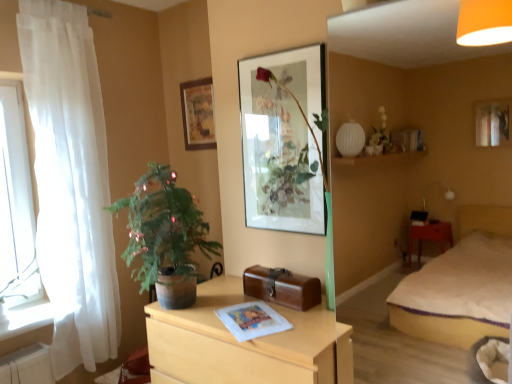
Question: Is the depth of green matte potted plant at left greater than that of wooden chest of drawers at center?

Choices:
 (A) no
 (B) yes

Answer: (B)

Question: Can you confirm if green matte potted plant at left is taller than wooden chest of drawers at center?

Choices:
 (A) yes
 (B) no

Answer: (B)

Question: From the image's perspective, would you say green matte potted plant at left is positioned over wooden chest of drawers at center?

Choices:
 (A) no
 (B) yes

Answer: (B)

Question: From a real-world perspective, is green matte potted plant at left physically below wooden chest of drawers at center?

Choices:
 (A) yes
 (B) no

Answer: (B)

Question: Considering the relative positions of green matte potted plant at left and wooden chest of drawers at center in the image provided, is green matte potted plant at left to the left of wooden chest of drawers at center from the viewer's perspective?

Choices:
 (A) yes
 (B) no

Answer: (A)

Question: Is wooden chest of drawers at center to the left or to the right of green matte potted plant at left in the image?

Choices:
 (A) left
 (B) right

Answer: (B)

Question: Based on their sizes in the image, would you say wooden chest of drawers at center is bigger or smaller than green matte potted plant at left?

Choices:
 (A) big
 (B) small

Answer: (A)

Question: From a real-world perspective, relative to green matte potted plant at left, is wooden chest of drawers at center vertically above or below?

Choices:
 (A) below
 (B) above

Answer: (A)

Question: In terms of height, does wooden chest of drawers at center look taller or shorter compared to green matte potted plant at left?

Choices:
 (A) short
 (B) tall

Answer: (B)

Question: Does point (57, 263) appear closer or farther from the camera than point (177, 375)?

Choices:
 (A) farther
 (B) closer

Answer: (A)

Question: Based on their positions, is white sheer curtain at left located to the left or right of wooden chest of drawers at center?

Choices:
 (A) left
 (B) right

Answer: (A)

Question: Is white sheer curtain at left wider or thinner than wooden chest of drawers at center?

Choices:
 (A) thin
 (B) wide

Answer: (A)

Question: In terms of size, does white sheer curtain at left appear bigger or smaller than wooden chest of drawers at center?

Choices:
 (A) small
 (B) big

Answer: (A)

Question: In terms of width, does white sheer curtain at left look wider or thinner when compared to brown leather suitcase at center?

Choices:
 (A) thin
 (B) wide

Answer: (A)

Question: Would you say white sheer curtain at left is to the left or to the right of brown leather suitcase at center in the picture?

Choices:
 (A) left
 (B) right

Answer: (A)